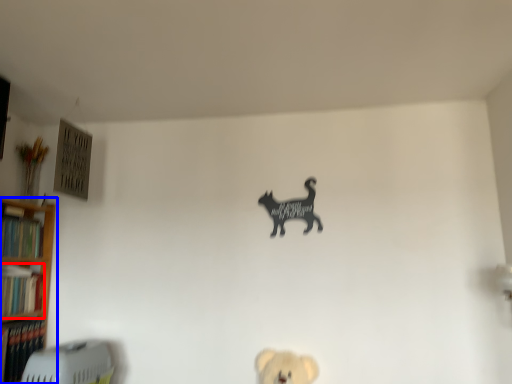
Question: Which of the following is the farthest to the observer, book (highlighted by a red box) or shelf (highlighted by a blue box)?

Choices:
 (A) book
 (B) shelf

Answer: (A)